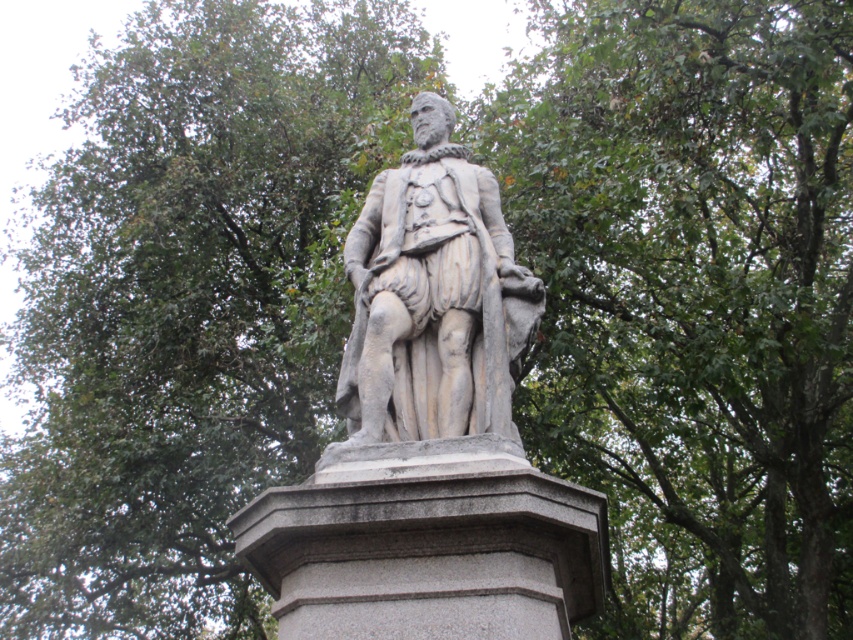
Consider the image. How distant is gray granite pedestal at center from stone statue at center?

7.32 meters

Which of these two, gray granite pedestal at center or stone statue at center, stands shorter?

With less height is gray granite pedestal at center.

Between point (372, 480) and point (518, 353), which one is positioned in front?

Point (372, 480) is more forward.

At what (x,y) coordinates should I click in order to perform the action: click on gray granite pedestal at center. Please return your answer as a coordinate pair (x, y). Looking at the image, I should click on (428, 554).